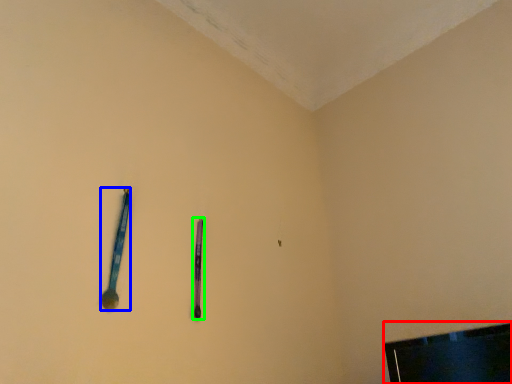
Question: Which object is the closest to the television (highlighted by a red box)? Choose among these: spoon (highlighted by a blue box) or writing (highlighted by a green box).

Choices:
 (A) spoon
 (B) writing

Answer: (B)